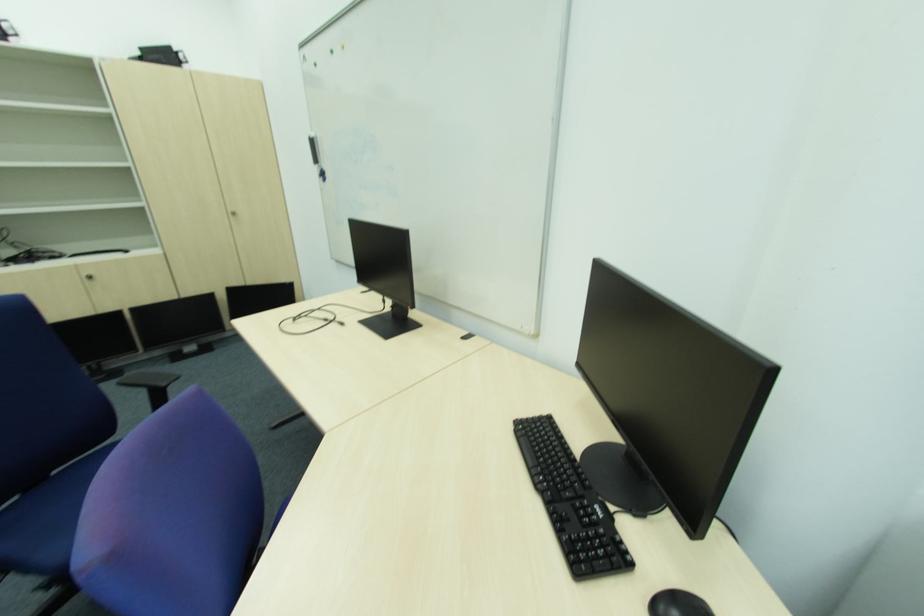
Where would you sit the blue chair sitting surface? Please return your answer as a coordinate pair (x, y).

(46, 519)